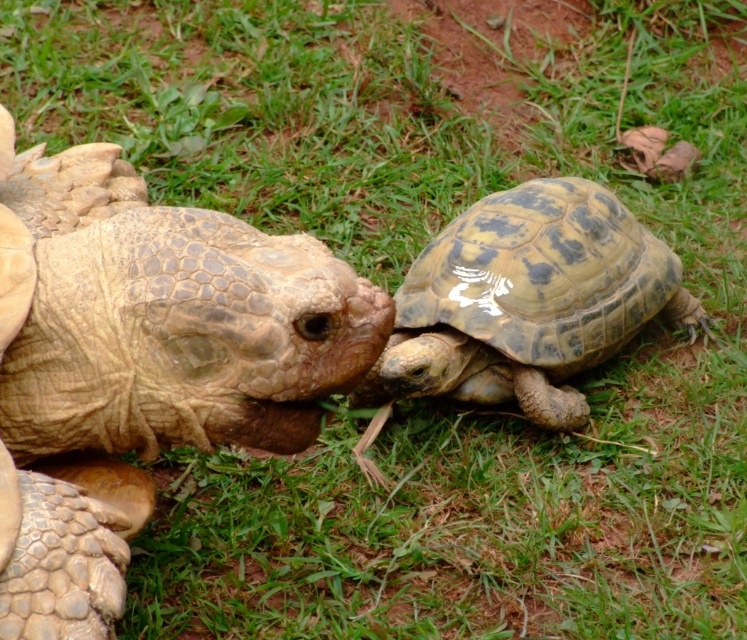
Question: Which of the following is the closest to the observer?

Choices:
 (A) leathery brown tortoise at center
 (B) shiny greenish-brown tortoise at right

Answer: (A)

Question: Does leathery brown tortoise at center appear over shiny greenish-brown tortoise at right?

Choices:
 (A) no
 (B) yes

Answer: (B)

Question: Among these objects, which one is farthest from the camera?

Choices:
 (A) leathery brown tortoise at center
 (B) shiny greenish-brown tortoise at right

Answer: (B)

Question: Does leathery brown tortoise at center have a smaller size compared to shiny greenish-brown tortoise at right?

Choices:
 (A) no
 (B) yes

Answer: (A)

Question: Which point is closer to the camera?

Choices:
 (A) (477, 308)
 (B) (81, 253)

Answer: (B)

Question: Does leathery brown tortoise at center appear on the right side of shiny greenish-brown tortoise at right?

Choices:
 (A) no
 (B) yes

Answer: (A)